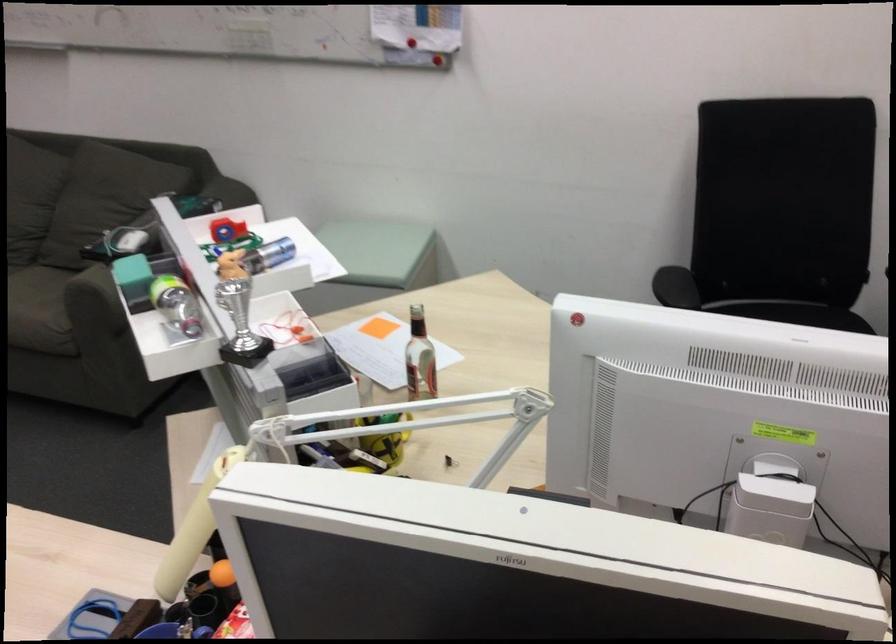
Image resolution: width=896 pixels, height=644 pixels. Describe the element at coordinates (419, 359) in the screenshot. I see `the glass bottle` at that location.